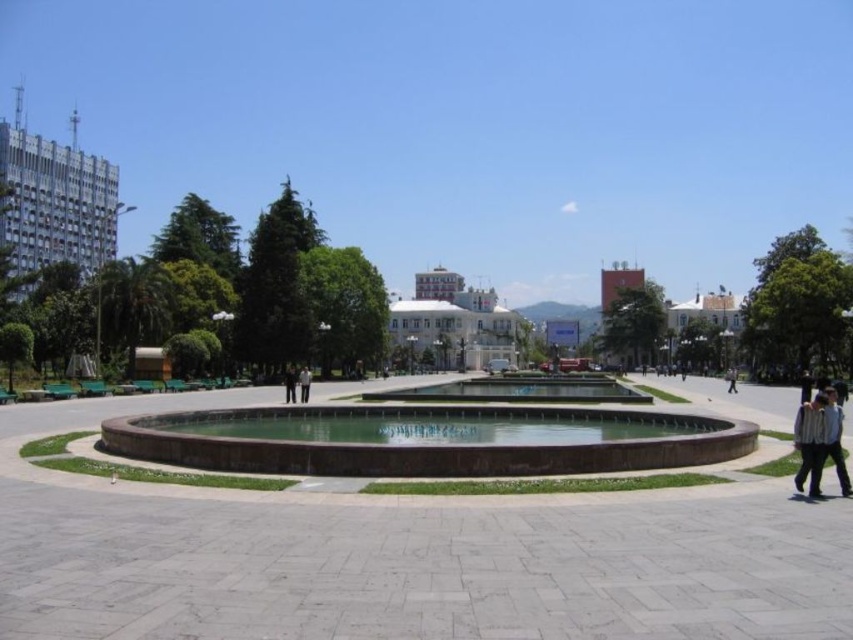
Between dark gray suit at center and light gray fabric jacket at lower right, which one has more height?

Standing taller between the two is light gray fabric jacket at lower right.

Based on the photo, does dark gray suit at center have a lesser width compared to light gray fabric jacket at lower right?

Correct, dark gray suit at center's width is less than light gray fabric jacket at lower right's.

What do you see at coordinates (305, 384) in the screenshot?
I see `dark gray suit at center` at bounding box center [305, 384].

Find the location of `dark gray suit at center`. dark gray suit at center is located at coordinates (305, 384).

I want to click on black leather pants at center, so click(x=289, y=384).

Can you confirm if black leather pants at center is bigger than light gray fabric jacket at lower right?

Incorrect, black leather pants at center is not larger than light gray fabric jacket at lower right.

Identify the location of black leather pants at center. (289, 384).

Can you confirm if light blue shirt at right is bigger than light gray fabric jacket at lower right?

No, light blue shirt at right is not bigger than light gray fabric jacket at lower right.

Can you confirm if light blue shirt at right is wider than light gray fabric jacket at lower right?

Incorrect, light blue shirt at right's width does not surpass light gray fabric jacket at lower right's.

Is point (825, 419) behind point (733, 385)?

No, (825, 419) is in front of (733, 385).

This screenshot has height=640, width=853. What are the coordinates of `light blue shirt at right` in the screenshot? It's located at (834, 438).